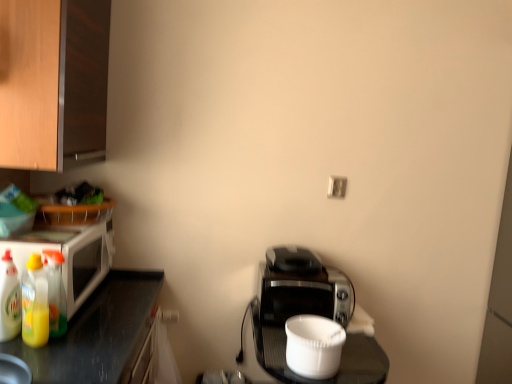
Question: Can you confirm if white plastic electric outlet at upper center is wider than translucent plastic bottles at left, the 1th bottle when ordered from right to left?

Choices:
 (A) no
 (B) yes

Answer: (A)

Question: Can you confirm if white plastic electric outlet at upper center is smaller than translucent plastic bottles at left, the 1th bottle when ordered from right to left?

Choices:
 (A) yes
 (B) no

Answer: (A)

Question: Does white plastic electric outlet at upper center appear on the left side of translucent plastic bottles at left, the 1th bottle when ordered from right to left?

Choices:
 (A) yes
 (B) no

Answer: (B)

Question: Considering the relative positions of white plastic electric outlet at upper center and translucent plastic bottles at left, the 1th bottle when ordered from right to left, in the image provided, is white plastic electric outlet at upper center to the right of translucent plastic bottles at left, the 1th bottle when ordered from right to left, from the viewer's perspective?

Choices:
 (A) yes
 (B) no

Answer: (A)

Question: From the image's perspective, is white plastic electric outlet at upper center beneath translucent plastic bottles at left, the 1th bottle when ordered from right to left?

Choices:
 (A) no
 (B) yes

Answer: (A)

Question: Is white plastic electric outlet at upper center completely or partially outside of translucent plastic bottles at left, the 3th bottle from the left?

Choices:
 (A) no
 (B) yes

Answer: (B)

Question: Can you confirm if translucent plastic bottles at left, the 1th bottle when ordered from right to left, is thinner than black plastic toaster at center, the second appliance when ordered from front to back?

Choices:
 (A) no
 (B) yes

Answer: (B)

Question: Is translucent plastic bottles at left, the 3th bottle from the left, smaller than black plastic toaster at center, the second appliance when ordered from front to back?

Choices:
 (A) no
 (B) yes

Answer: (B)

Question: Is translucent plastic bottles at left, the 3th bottle from the left, to the left of black plastic toaster at center, which is the first appliance from back to front, from the viewer's perspective?

Choices:
 (A) no
 (B) yes

Answer: (B)

Question: Can you confirm if translucent plastic bottles at left, the 1th bottle when ordered from right to left, is wider than black plastic toaster at center, which is the first appliance from back to front?

Choices:
 (A) no
 (B) yes

Answer: (A)

Question: Is translucent plastic bottles at left, the 3th bottle from the left, not close to black plastic toaster at center, which is the first appliance from back to front?

Choices:
 (A) no
 (B) yes

Answer: (A)

Question: From a real-world perspective, does translucent plastic bottles at left, the 1th bottle when ordered from right to left, sit lower than black plastic toaster at center, which is the first appliance from back to front?

Choices:
 (A) no
 (B) yes

Answer: (A)

Question: Is wooden cabinet at upper left completely or partially inside black plastic toaster at center, which is the first appliance from back to front?

Choices:
 (A) no
 (B) yes

Answer: (A)